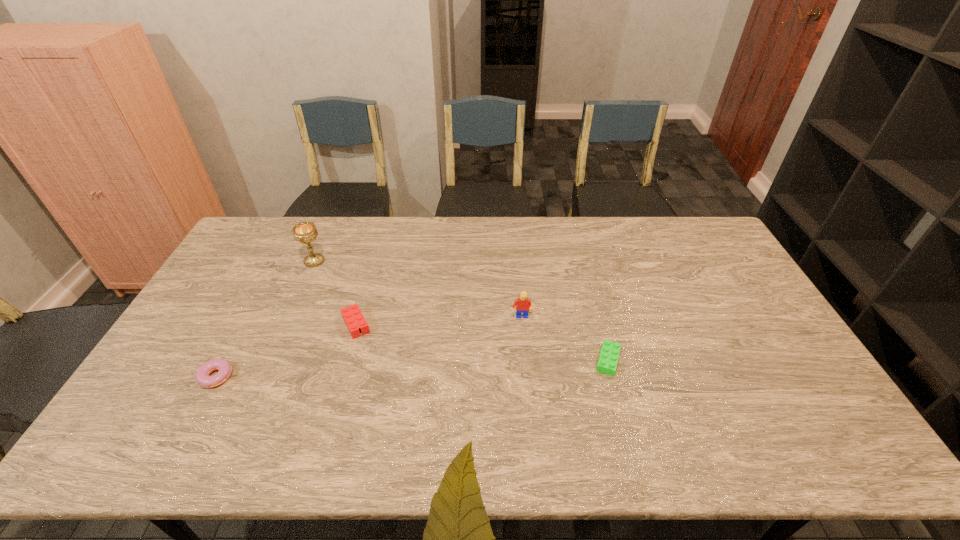
The width and height of the screenshot is (960, 540). What are the coordinates of `blank space located 0.250m on the back of the leftmost Lego` in the screenshot? It's located at (374, 259).

At what (x,y) coordinates should I click in order to perform the action: click on vacant space located 0.120m on the front of the rightmost Lego. Please return your answer as a coordinate pair (x, y). Looking at the image, I should click on (623, 417).

Where is `free region located 0.070m on the front of the leftmost object`? This screenshot has width=960, height=540. free region located 0.070m on the front of the leftmost object is located at coordinates (196, 415).

At what (x,y) coordinates should I click in order to perform the action: click on object that is at the far edge. Please return your answer as a coordinate pair (x, y). Image resolution: width=960 pixels, height=540 pixels. Looking at the image, I should click on tap(305, 232).

Image resolution: width=960 pixels, height=540 pixels. I want to click on object located in the left edge section of the desktop, so click(x=202, y=374).

Identify the location of free space at the far edge of the desktop. Image resolution: width=960 pixels, height=540 pixels. (497, 237).

At what (x,y) coordinates should I click in order to perform the action: click on free point at the near edge. Please return your answer as a coordinate pair (x, y). Looking at the image, I should click on (599, 441).

Identify the location of vacant area at the left edge of the desktop. (252, 258).

Locate an element on the screen. This screenshot has height=540, width=960. free space at the right edge is located at coordinates (775, 339).

Identify the location of free region at the far left corner of the desktop. The width and height of the screenshot is (960, 540). (245, 237).